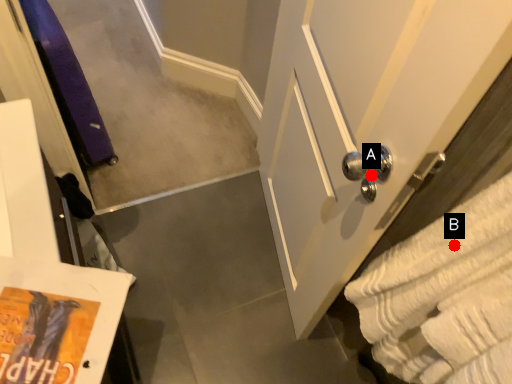
Question: Two points are circled on the image, labeled by A and B beside each circle. Which point is closer to the camera?

Choices:
 (A) A is closer
 (B) B is closer

Answer: (B)